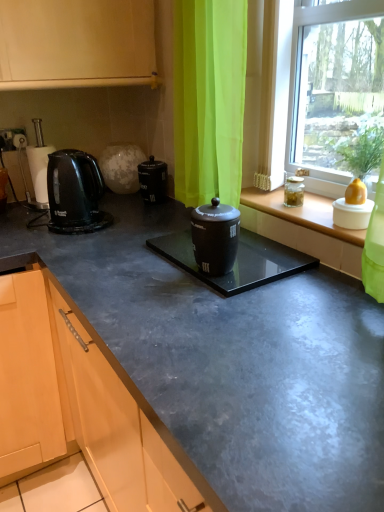
I want to click on free location in front of black glossy electric kettle at left, so click(x=54, y=242).